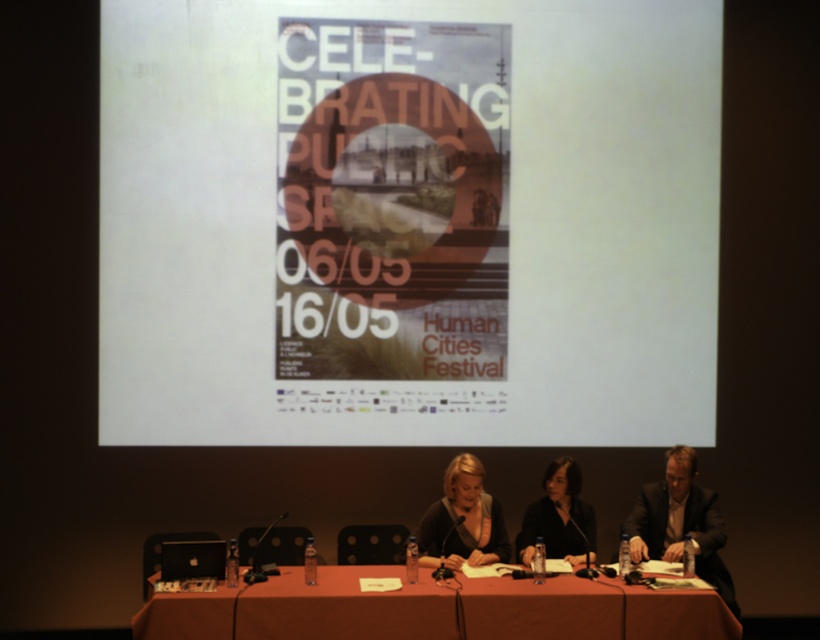
Is point (125, 221) positioned after point (467, 461)?

That is True.

Who is more distant from viewer, [349,141] or [451,497]?

The point [349,141] is behind.

The height and width of the screenshot is (640, 820). Find the location of `white paper at center`. white paper at center is located at coordinates (408, 221).

Based on the photo, who is lower down, white paper at center or dark gray suit at center?

dark gray suit at center

Find the location of a particular element. Image resolution: width=820 pixels, height=640 pixels. white paper at center is located at coordinates (408, 221).

Identify the location of dark suit at center. (680, 522).

Does dark suit at center appear under dark gray suit at center?

Actually, dark suit at center is above dark gray suit at center.

Which is behind, point (649, 506) or point (572, 458)?

Positioned behind is point (572, 458).

Find the location of a particular element. Image resolution: width=820 pixels, height=640 pixels. dark suit at center is located at coordinates (680, 522).